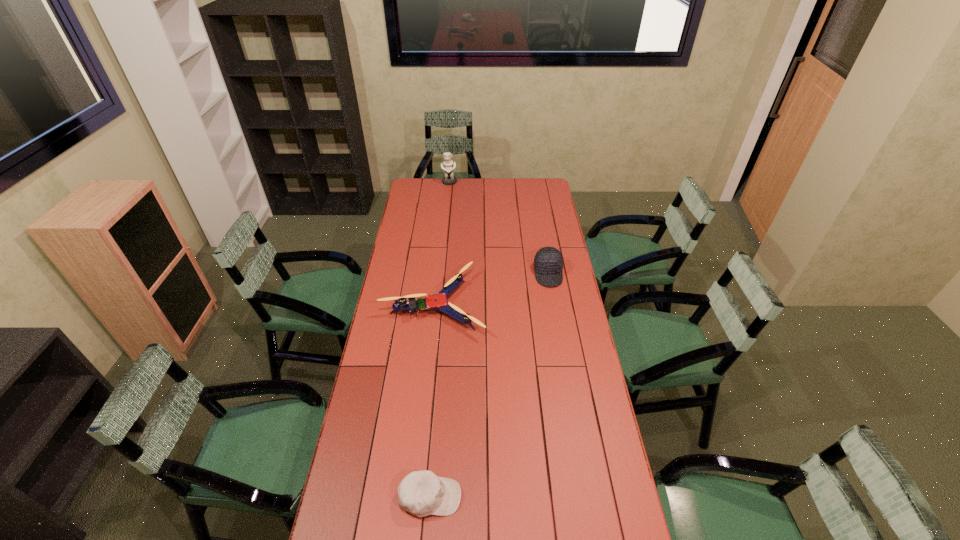
Find the location of `free space located 0.230m on the front-facing side of the shorter baseball cap`. free space located 0.230m on the front-facing side of the shorter baseball cap is located at coordinates (536, 497).

Image resolution: width=960 pixels, height=540 pixels. I want to click on object situated at the far edge, so click(448, 166).

Locate an element on the screen. object situated at the left edge is located at coordinates (438, 301).

This screenshot has width=960, height=540. In order to click on object that is positioned at the right edge in this screenshot , I will do `click(548, 262)`.

Where is `free space at the far edge`? The width and height of the screenshot is (960, 540). free space at the far edge is located at coordinates (509, 180).

In the image, there is a desktop. Where is `vacant space at the left edge`? Image resolution: width=960 pixels, height=540 pixels. vacant space at the left edge is located at coordinates (417, 265).

In the image, there is a desktop. At what (x,y) coordinates should I click in order to perform the action: click on vacant space at the right edge. Please return your answer as a coordinate pair (x, y). This screenshot has width=960, height=540. Looking at the image, I should click on (572, 405).

Identify the location of vacant space at the far left corner of the desktop. (421, 180).

In the image, there is a desktop. Where is `free space at the far right corner`? free space at the far right corner is located at coordinates (549, 179).

The width and height of the screenshot is (960, 540). In order to click on free point between the right baseball cap and the left baseball cap in this screenshot , I will do 490,386.